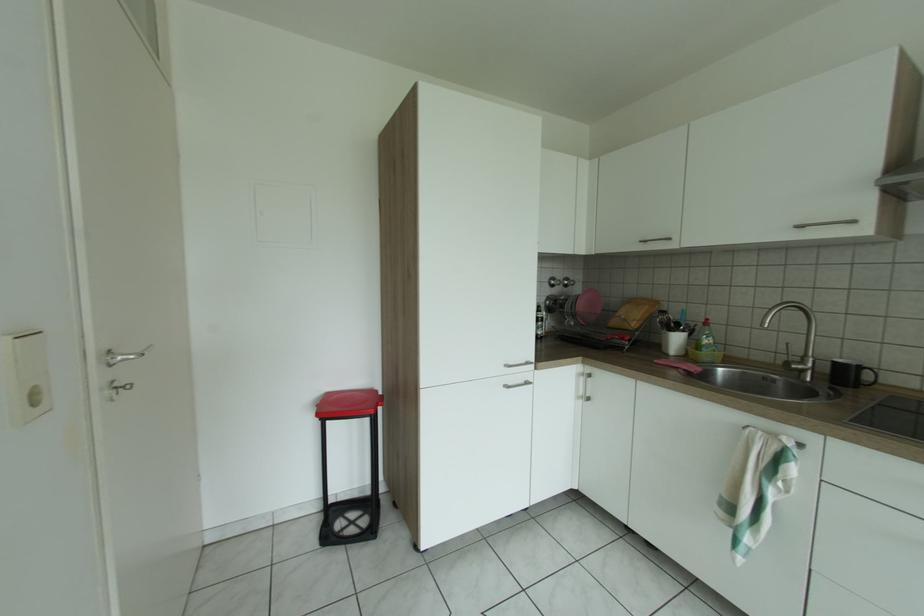
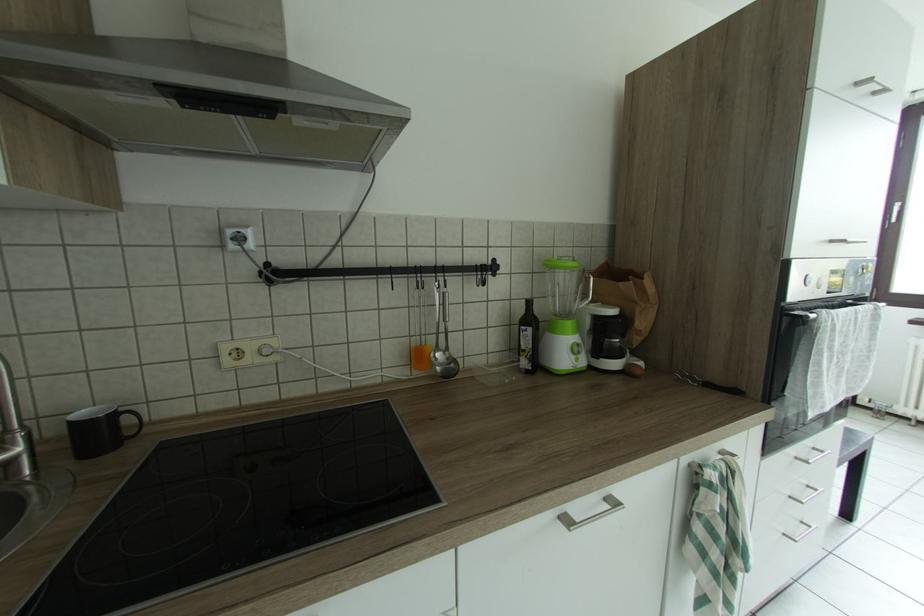
Question: The images are taken continuously from a first-person perspective. In which direction is your viewpoint rotating?

Choices:
 (A) Left
 (B) Right
 (C) Up
 (D) Down

Answer: (B)